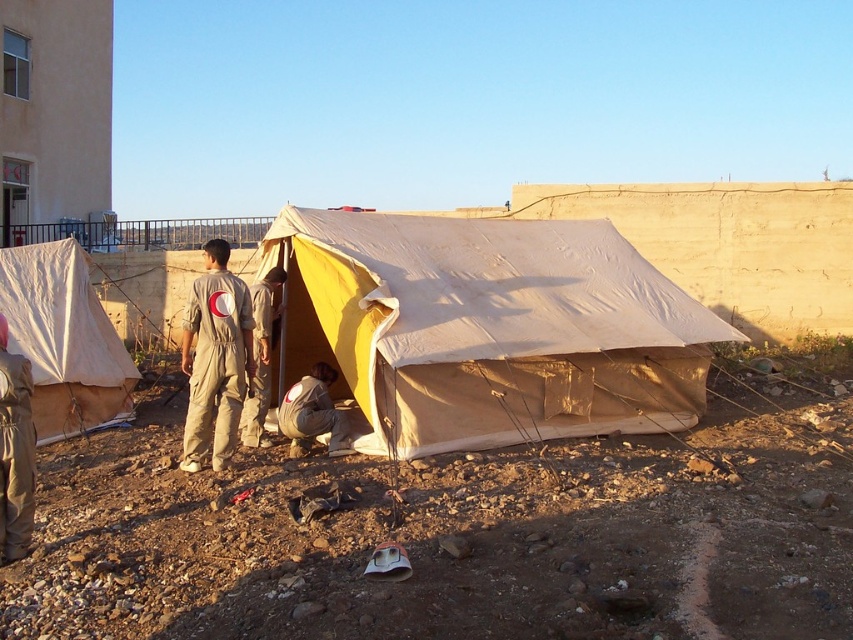
Is beige canvas tent at center below beige fabric jumpsuit at center?

Actually, beige canvas tent at center is above beige fabric jumpsuit at center.

Locate an element on the screen. beige canvas tent at center is located at coordinates point(488,326).

Identify the location of beige canvas tent at center. The width and height of the screenshot is (853, 640). (488, 326).

Is beige fabric jumpsuit at center below khaki uniform at center?

No.

How much distance is there between beige fabric jumpsuit at center and khaki uniform at center?

They are 34.29 inches apart.

Is point (219, 385) positioned before point (286, 422)?

Yes.

Where is `beige fabric jumpsuit at center`? The image size is (853, 640). beige fabric jumpsuit at center is located at coordinates (215, 358).

Does beige fabric jumpsuit at center have a lesser height compared to khaki fabric jumpsuit at center?

No, beige fabric jumpsuit at center is not shorter than khaki fabric jumpsuit at center.

Who is positioned more to the right, beige fabric jumpsuit at center or khaki fabric jumpsuit at center?

khaki fabric jumpsuit at center is more to the right.

Identify the location of beige fabric jumpsuit at center. The width and height of the screenshot is (853, 640). (215, 358).